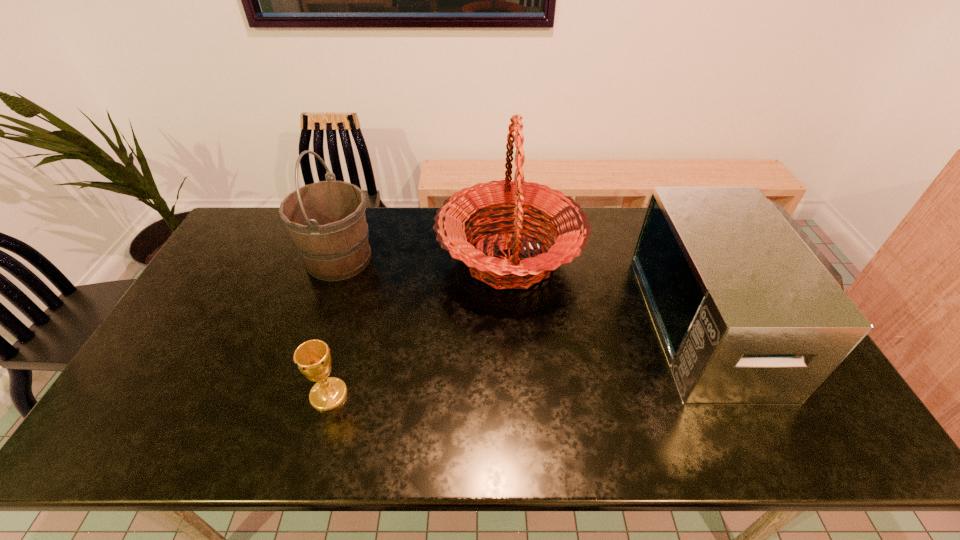
You are a GUI agent. You are given a task and a screenshot of the screen. Output one action in this format:
    pyautogui.click(x=<x>, y=<y>)
    Task: Click on the empty space between the microwave oven and the shortest object
    Image resolution: width=960 pixels, height=540 pixels.
    Given the screenshot: What is the action you would take?
    pyautogui.click(x=523, y=359)

Where is `vacant area that lies between the bucket and the second object from right to left`? vacant area that lies between the bucket and the second object from right to left is located at coordinates pos(424,259).

This screenshot has height=540, width=960. What are the coordinates of `free spot between the third object from left to right and the rightmost object` in the screenshot? It's located at (614, 291).

Where is `free space between the rightmost object and the tallest object`? free space between the rightmost object and the tallest object is located at coordinates (614, 291).

Identify the location of empty location between the basket and the third tallest object. (614, 291).

This screenshot has width=960, height=540. In order to click on free point between the bucket and the microwave oven in this screenshot , I will do click(529, 291).

Find the location of a particular element. This screenshot has height=540, width=960. unoccupied position between the second shortest object and the third shortest object is located at coordinates (529, 291).

Locate an element on the screen. This screenshot has height=540, width=960. empty space that is in between the rightmost object and the basket is located at coordinates (614, 291).

The width and height of the screenshot is (960, 540). Identify the location of vacant space in between the bucket and the basket. (424, 259).

Where is `object identified as the second closest to the chalice`? This screenshot has height=540, width=960. object identified as the second closest to the chalice is located at coordinates (326, 220).